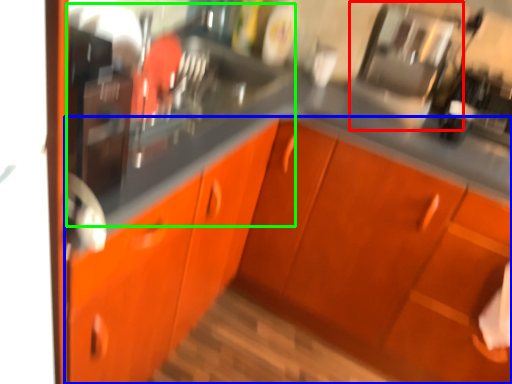
Question: Based on their relative distances, which object is nearer to appliance (highlighted by a red box)? Choose from cabinetry (highlighted by a blue box) and sink (highlighted by a green box).

Choices:
 (A) cabinetry
 (B) sink

Answer: (B)